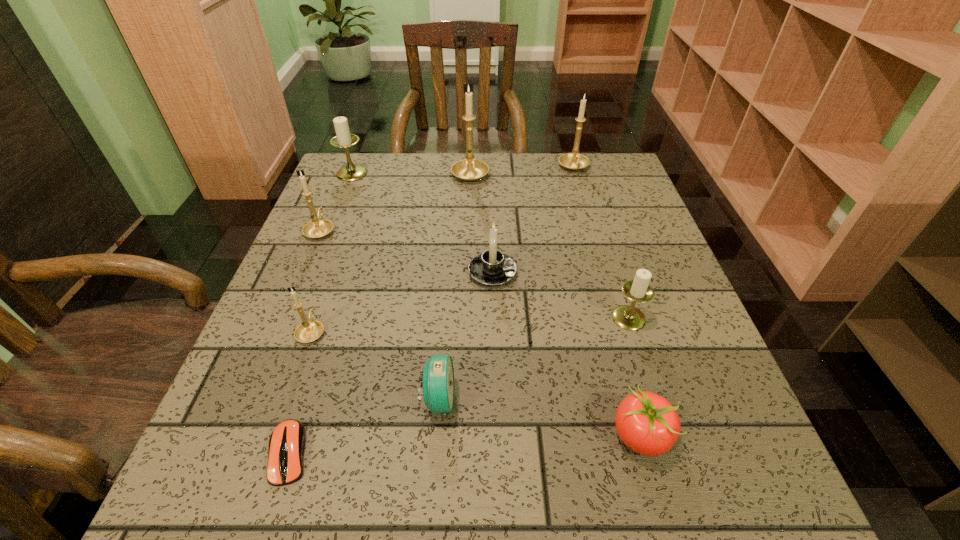
Locate an element on the screen. This screenshot has width=960, height=540. vacant position at the right edge of the desktop is located at coordinates (608, 238).

Find the location of a particular element. The height and width of the screenshot is (540, 960). vacant space at the far left corner of the desktop is located at coordinates (348, 186).

This screenshot has height=540, width=960. I want to click on vacant space at the far right corner, so click(603, 187).

Where is `free space at the near right corner of the desktop`? free space at the near right corner of the desktop is located at coordinates (670, 485).

What are the coordinates of `free spot between the alarm clock and the nearest gold candle holder` in the screenshot? It's located at (374, 366).

The width and height of the screenshot is (960, 540). Find the location of `free spot between the nearest gold candle holder and the tomato`. free spot between the nearest gold candle holder and the tomato is located at coordinates (476, 384).

Locate an element on the screen. The image size is (960, 540). free space that is in between the biggest gold candle holder and the second gold candle holder from left to right is located at coordinates (391, 252).

This screenshot has width=960, height=540. Find the location of `free space between the leftmost gold candle holder and the nearest gold candle holder`. free space between the leftmost gold candle holder and the nearest gold candle holder is located at coordinates (316, 281).

Identify the location of vacant area between the second tallest candle holder and the smallest gold candle holder. (443, 250).

This screenshot has width=960, height=540. Identify the location of vacant space that is in between the leftmost gold candle holder and the alarm clock. (379, 315).